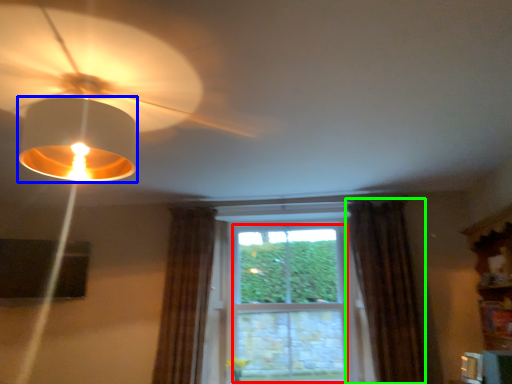
Question: Which object is the farthest from bay window (highlighted by a red box)? Choose among these: lamp (highlighted by a blue box) or curtain (highlighted by a green box).

Choices:
 (A) lamp
 (B) curtain

Answer: (A)